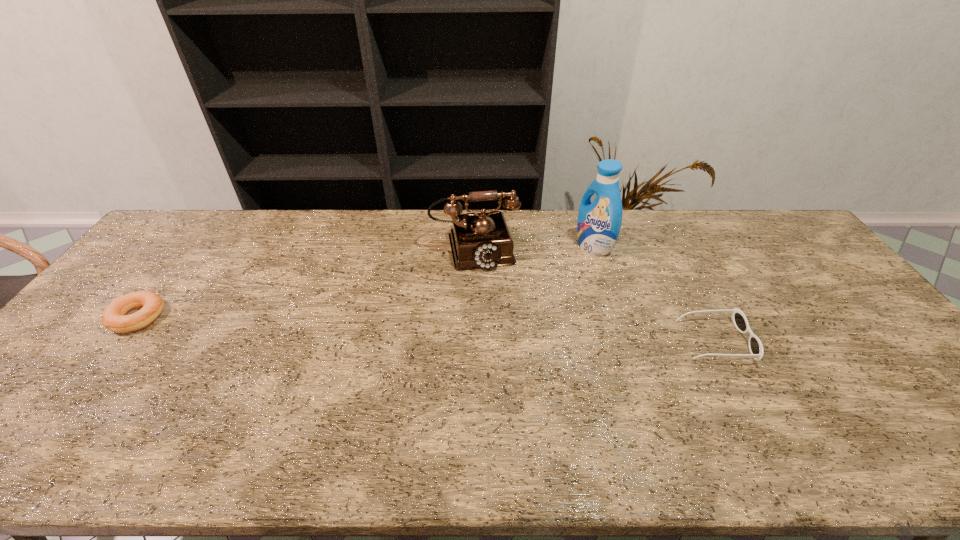
Identify the location of vacant space at the right edge of the desktop. (808, 276).

The image size is (960, 540). What are the coordinates of `unoccupied area between the leftmost object and the telephone` in the screenshot? It's located at (306, 282).

Where is `unoccupied area between the third object from left to right and the leftmost object`? The height and width of the screenshot is (540, 960). unoccupied area between the third object from left to right and the leftmost object is located at coordinates (366, 282).

You are a GUI agent. You are given a task and a screenshot of the screen. Output one action in this format:
    pyautogui.click(x=<x>, y=<y>)
    Task: Click on the vacant point located between the rightmost object and the bagel
    The image size is (960, 540).
    Given the screenshot: What is the action you would take?
    pyautogui.click(x=427, y=329)

This screenshot has height=540, width=960. I want to click on vacant point located between the third object from right to left and the detergent, so click(x=534, y=247).

This screenshot has height=540, width=960. What are the coordinates of `free spot between the rightmost object and the leftmost object` in the screenshot? It's located at click(427, 329).

The width and height of the screenshot is (960, 540). I want to click on vacant area that lies between the leftmost object and the rightmost object, so click(x=427, y=329).

Locate an element on the screen. This screenshot has height=540, width=960. vacant area that lies between the sunglasses and the tallest object is located at coordinates (655, 294).

Where is `vacant area that lies between the third object from left to right and the sunglasses`? vacant area that lies between the third object from left to right and the sunglasses is located at coordinates (655, 294).

At what (x,y) coordinates should I click in order to perform the action: click on free spot between the rightmost object and the bagel. Please return your answer as a coordinate pair (x, y). Looking at the image, I should click on (427, 329).